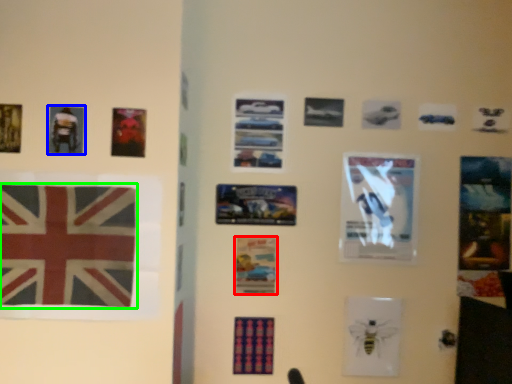
Question: Which is nearer to the poster (highlighted by a red box)? poster (highlighted by a blue box) or flag (highlighted by a green box).

Choices:
 (A) poster
 (B) flag

Answer: (B)